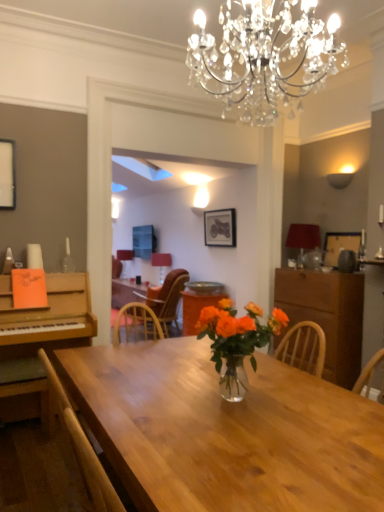
What do you see at coordinates (340, 246) in the screenshot? I see `wooden picture frame at right, positioned as the second picture frame in back-to-front order` at bounding box center [340, 246].

What do you see at coordinates (236, 341) in the screenshot? I see `translucent glass vase at center` at bounding box center [236, 341].

Identify the location of wooden chair at lower left, the 2th chair positioned from the back. (29, 383).

In order to face transparent glass bottle at left, should I rotate leftwards or rightwards?

A 15.980 degree turn to the left will do.

At what (x,y) coordinates should I click in order to perform the action: click on matte red lampshade at center, which appears as the first lamp when viewed from the right. Please return your answer as a coordinate pair (x, y). This screenshot has width=384, height=512. Looking at the image, I should click on (161, 263).

Based on the photo, is wooden chair at lower left, the second chair from the right, at the left side of brown wood cabinet at right?

Correct, you'll find wooden chair at lower left, the second chair from the right, to the left of brown wood cabinet at right.

From the image's perspective, who appears lower, wooden chair at lower left, the 1th chair when ordered from front to back, or brown wood cabinet at right?

wooden chair at lower left, the 1th chair when ordered from front to back, from the image's perspective.

Which object is closer to the camera, wooden chair at lower left, the second chair from the right, or brown wood cabinet at right?

wooden chair at lower left, the second chair from the right.

Can you confirm if wooden chair at lower left, the second chair from the right, is wider than brown wood cabinet at right?

No, wooden chair at lower left, the second chair from the right, is not wider than brown wood cabinet at right.

Considering the relative positions of wooden chair at lower left, the 2th chair positioned from the back, and translucent glass vase at center in the image provided, is wooden chair at lower left, the 2th chair positioned from the back, to the right of translucent glass vase at center from the viewer's perspective?

Incorrect, wooden chair at lower left, the 2th chair positioned from the back, is not on the right side of translucent glass vase at center.

Can translucent glass vase at center be found inside wooden chair at lower left, the second chair from the right?

No, translucent glass vase at center is not a part of wooden chair at lower left, the second chair from the right.

From a real-world perspective, who is located higher, wooden chair at lower left, the 1th chair when ordered from front to back, or translucent glass vase at center?

translucent glass vase at center is physically above.

Looking at this image, are wooden chair at lower left, the 1th chair when ordered from front to back, and shiny wood table at center located far from each other?

Yes, wooden chair at lower left, the 1th chair when ordered from front to back, and shiny wood table at center are located far from each other.

Is wooden chair at lower left, the 1th chair when ordered from front to back, bigger or smaller than shiny wood table at center?

In the image, wooden chair at lower left, the 1th chair when ordered from front to back, appears to be smaller than shiny wood table at center.

From the image's perspective, is wooden chair at lower left, the first chair from the left, beneath shiny wood table at center?

Yes, from the image's perspective, wooden chair at lower left, the first chair from the left, is below shiny wood table at center.

Looking at this image, is the depth of wooden chair at lower left, the second chair from the right, greater than that of shiny wood table at center?

Yes, the depth of wooden chair at lower left, the second chair from the right, is greater than that of shiny wood table at center.

Considering the points (304, 390) and (252, 364), which point is behind, point (304, 390) or point (252, 364)?

The point (252, 364) is farther.

Between shiny wood table at center and translucent glass vase at center, which one has less height?

translucent glass vase at center.

Consider the image. Is shiny wood table at center aimed at translucent glass vase at center?

No, shiny wood table at center is not aimed at translucent glass vase at center.

Find the location of `desk below the translucent glass vase at center (from the image's perspective)`. desk below the translucent glass vase at center (from the image's perspective) is located at coordinates pyautogui.click(x=226, y=431).

Can you tell me how much shiny wood table at center and translucent glass vase at center differ in facing direction?

178 degrees separate the facing orientations of shiny wood table at center and translucent glass vase at center.

Can you confirm if shiny wood table at center is bigger than translucent glass vase at center?

No, shiny wood table at center is not bigger than translucent glass vase at center.

Based on the photo, from a real-world perspective, which is physically below, shiny wood table at center or translucent glass vase at center?

From a 3D spatial view, translucent glass vase at center is below.

Between translucent glass vase at center and matte red lampshade at center, which is the 2th lamp from back to front, which one appears on the right side from the viewer's perspective?

Positioned to the right is translucent glass vase at center.

From a real-world perspective, is translucent glass vase at center physically above matte red lampshade at center, marked as the 1th lamp in a front-to-back arrangement?

Yes, from a real-world perspective, translucent glass vase at center is on top of matte red lampshade at center, marked as the 1th lamp in a front-to-back arrangement.

From the image's perspective, relative to matte red lampshade at center, marked as the 1th lamp in a front-to-back arrangement, is translucent glass vase at center above or below?

Clearly, from the image's perspective, translucent glass vase at center is below matte red lampshade at center, marked as the 1th lamp in a front-to-back arrangement.

Can you tell me how much translucent glass vase at center and matte red lampshade at center, which appears as the first lamp when viewed from the right, differ in facing direction?

91.9 degrees.

Is point (216, 228) positioned before point (165, 256)?

Yes.

From the image's perspective, is black matte picture frame at upper center, the 1th picture frame positioned from the top, above matte red lampshade at center, which appears as the first lamp when viewed from the right?

Yes, from the image's perspective, black matte picture frame at upper center, the 1th picture frame positioned from the top, is on top of matte red lampshade at center, which appears as the first lamp when viewed from the right.

Is black matte picture frame at upper center, the 1th picture frame positioned from the top, further to the viewer compared to matte red lampshade at center, the 2th lamp in the left-to-right sequence?

No, the depth of black matte picture frame at upper center, the 1th picture frame positioned from the top, is less than that of matte red lampshade at center, the 2th lamp in the left-to-right sequence.

You are a GUI agent. You are given a task and a screenshot of the screen. Output one action in this format:
    pyautogui.click(x=<x>, y=<y>)
    Task: Click on the cabinetry positioned vertically above the wooden chair at lower left, the 2th chair positioned from the back (from a real-world perspective)
    This screenshot has height=512, width=384.
    Given the screenshot: What is the action you would take?
    pyautogui.click(x=327, y=315)

Identify the location of houseplant in front of the wooden chair at lower left, the 1th chair when ordered from front to back. (236, 341).

Considering their positions, is transparent glass bottle at left positioned closer to wooden chair at center, which is the 1th chair from right to left, than shiny wood table at center?

Among the two, transparent glass bottle at left is located nearer to wooden chair at center, which is the 1th chair from right to left.

From the picture: Looking at the image, which one is located closer to matte red lampshade at center, which appears as the first lamp when viewed from the right, wooden picture frame at right, the 1th picture frame from the front, or wooden chair at lower left, the second chair from the right?

The object closer to matte red lampshade at center, which appears as the first lamp when viewed from the right, is wooden picture frame at right, the 1th picture frame from the front.

Estimate the real-world distances between objects in this image. Which object is closer to matte red lampshade at center, the 2th lamp in the left-to-right sequence, shiny wood table at center or wooden chair at center, arranged as the second chair when viewed from the left?

Among the two, wooden chair at center, arranged as the second chair when viewed from the left, is located nearer to matte red lampshade at center, the 2th lamp in the left-to-right sequence.

When comparing their distances from black matte picture frame at upper center, acting as the first picture frame starting from the back, does translucent glass vase at center or translucent glass vase at center seem further?

translucent glass vase at center.

Based on their spatial positions, is wooden chair at lower left, the first chair from the left, or matte white lampshade at center, which ranks as the 1th lamp in left-to-right order, further from translucent glass vase at center?

matte white lampshade at center, which ranks as the 1th lamp in left-to-right order, is further to translucent glass vase at center.

Considering their positions, is wooden chair at lower left, the 2th chair positioned from the back, positioned closer to wooden picture frame at right, which is counted as the second picture frame, starting from the top, than translucent glass vase at center?

Among the two, translucent glass vase at center is located nearer to wooden picture frame at right, which is counted as the second picture frame, starting from the top.

Estimate the real-world distances between objects in this image. Which object is closer to wooden chair at center, the 1th chair from the back, translucent glass vase at center or black matte picture frame at upper center, the first picture frame from the left?

black matte picture frame at upper center, the first picture frame from the left, lies closer to wooden chair at center, the 1th chair from the back, than the other object.

From the image, which object appears to be nearer to matte white lampshade at center, acting as the first lamp starting from the back, black matte picture frame at upper center, the second picture frame when ordered from front to back, or transparent glass bottle at left?

Among the two, black matte picture frame at upper center, the second picture frame when ordered from front to back, is located nearer to matte white lampshade at center, acting as the first lamp starting from the back.

Find the location of a particular element. The width and height of the screenshot is (384, 512). bottle positioned between shiny wood table at center and black matte picture frame at upper center, the 1th picture frame positioned from the top, from near to far is located at coordinates (68, 258).

Find the location of a particular element. The image size is (384, 512). picture frame situated between transparent glass bottle at left and brown wood cabinet at right from left to right is located at coordinates (220, 228).

Locate an element on the screen. The height and width of the screenshot is (512, 384). table between transparent glass bottle at left and wooden picture frame at right, the first picture frame in the right-to-left sequence is located at coordinates (199, 304).

Where is `chair between shiny wood table at center and transparent glass bottle at left from front to back`? chair between shiny wood table at center and transparent glass bottle at left from front to back is located at coordinates (29, 383).